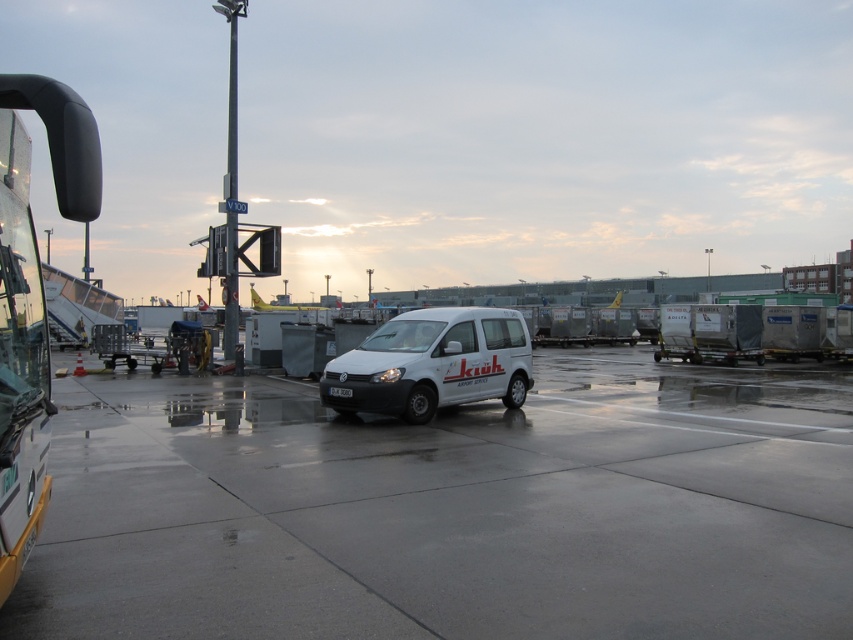
Question: Is white concrete tarmac at center bigger than white matte van at center?

Choices:
 (A) no
 (B) yes

Answer: (B)

Question: Which of the following is the farthest from the observer?

Choices:
 (A) white concrete tarmac at center
 (B) matte black bus at left

Answer: (A)

Question: Considering the relative positions of matte black bus at left and white matte van at center in the image provided, where is matte black bus at left located with respect to white matte van at center?

Choices:
 (A) above
 (B) below

Answer: (A)

Question: Can you confirm if white concrete tarmac at center is positioned to the left of white matte van at center?

Choices:
 (A) no
 (B) yes

Answer: (A)

Question: Which object appears farthest from the camera in this image?

Choices:
 (A) matte black bus at left
 (B) white matte van at center
 (C) white concrete tarmac at center

Answer: (B)

Question: Among these objects, which one is nearest to the camera?

Choices:
 (A) white matte van at center
 (B) matte black bus at left

Answer: (B)